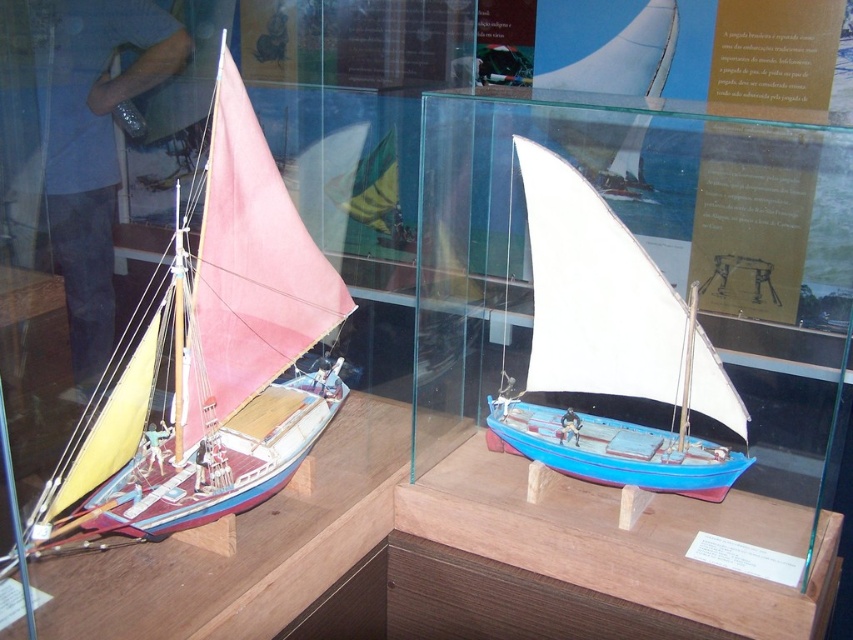
Is point (332, 266) behind point (670, 296)?

Yes, it is behind point (670, 296).

Who is more forward, (180, 429) or (695, 451)?

Point (180, 429)

What do you see at coordinates (209, 362) in the screenshot? I see `matte pink sail at left` at bounding box center [209, 362].

The width and height of the screenshot is (853, 640). I want to click on matte pink sail at left, so click(x=209, y=362).